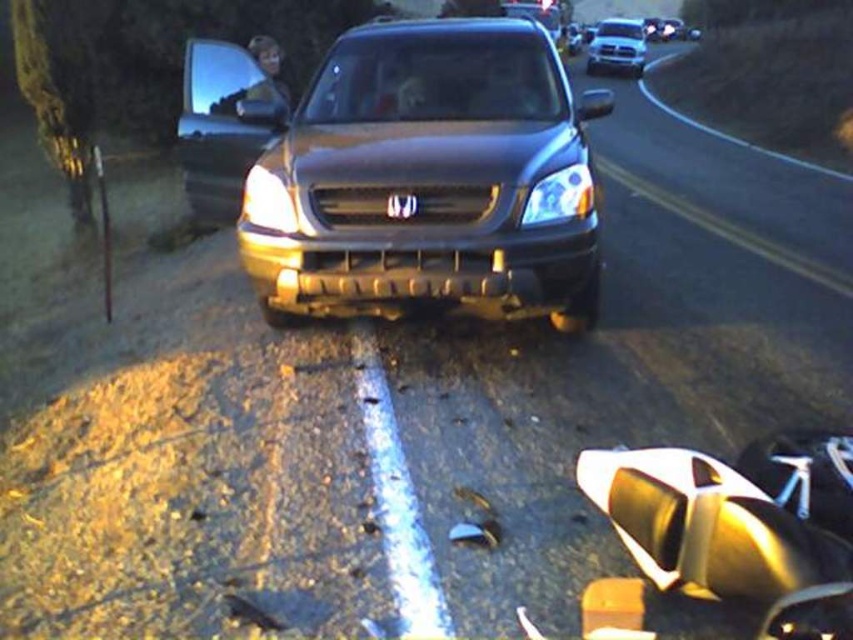
You are a traffic officer arriving at the scene of the accident. You see the satin black suv at center and the matte plastic headlight at center. Which object is taller?

The satin black suv at center is taller than the matte plastic headlight at center.

Looking at this image, you are a traffic officer arriving at the scene of a car accident. You need to determine the direction of the collision based on the positioning of the vehicles. Which object from the scene, the matte plastic headlight at center or the silver metallic truck at upper center, is positioned to the left of the other?

The matte plastic headlight at center is positioned to the left of the silver metallic truck at upper center.